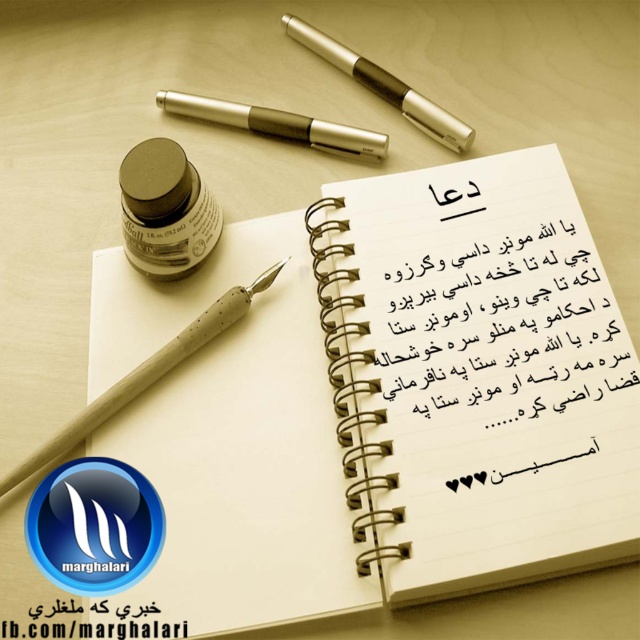
Question: Estimate the real-world distances between objects in this image. Which object is farther from the metallic pen at upper center?

Choices:
 (A) matte wood pencil at left
 (B) metallic pen at center
 (C) white paper at center

Answer: (A)

Question: Is matte black ink bottle at upper left to the right of metallic pen at center from the viewer's perspective?

Choices:
 (A) no
 (B) yes

Answer: (A)

Question: Is matte black ink bottle at upper left bigger than metallic pen at upper center?

Choices:
 (A) no
 (B) yes

Answer: (A)

Question: Does matte wood pencil at left have a larger size compared to metallic pen at upper center?

Choices:
 (A) no
 (B) yes

Answer: (B)

Question: Which of the following is the farthest from the observer?

Choices:
 (A) matte wood pencil at left
 (B) matte black ink bottle at upper left
 (C) metallic pen at upper center
 (D) metallic pen at center

Answer: (D)

Question: Considering the real-world distances, which object is closest to the white paper at center?

Choices:
 (A) metallic pen at upper center
 (B) matte black ink bottle at upper left
 (C) matte wood pencil at left

Answer: (A)